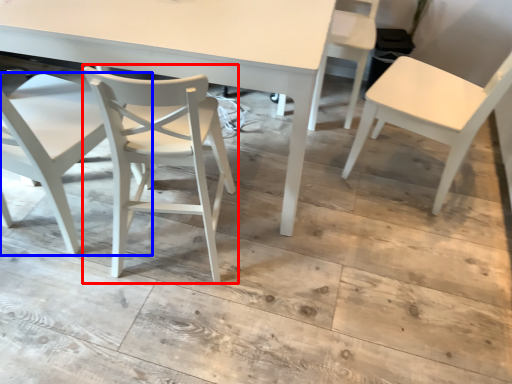
Question: Which of the following is the closest to the observer, chair (highlighted by a red box) or chair (highlighted by a blue box)?

Choices:
 (A) chair
 (B) chair

Answer: (B)